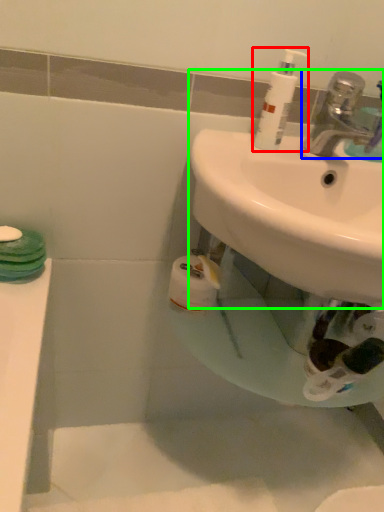
Question: Which object is the closest to the cleaning product (highlighted by a red box)? Choose among these: tap (highlighted by a blue box) or sink (highlighted by a green box).

Choices:
 (A) tap
 (B) sink

Answer: (A)